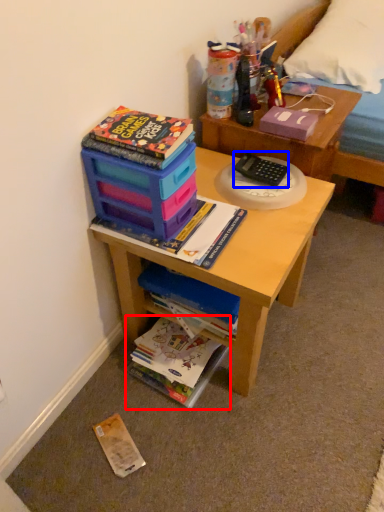
Question: Which object appears farthest to the camera in this image, book (highlighted by a red box) or stationery (highlighted by a blue box)?

Choices:
 (A) book
 (B) stationery

Answer: (A)